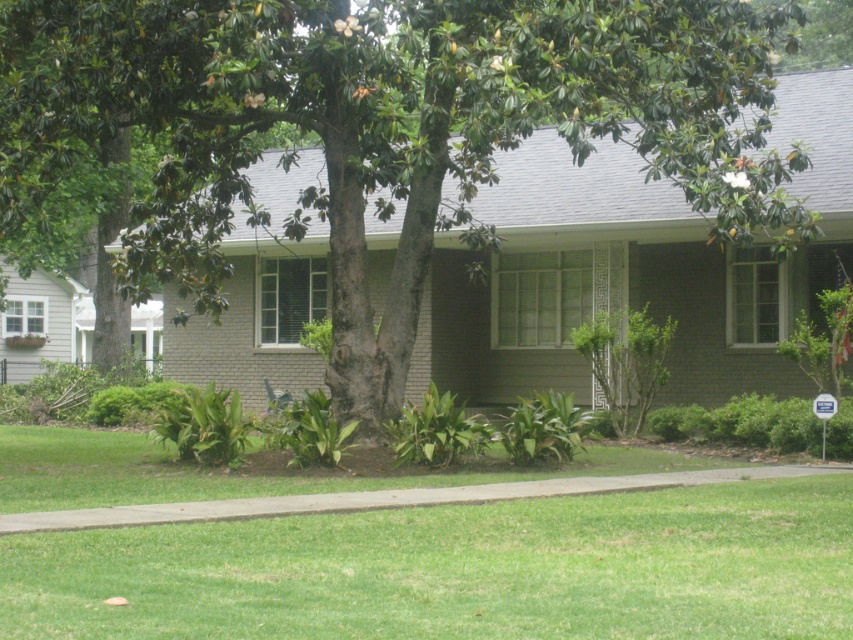
You are standing at the entrance of the suburban house and want to water the plant located at point [383,128]. Based on the given information, which plant should you water?

The point [383,128] is on the green leafy tree at center, so you should water the green leafy tree at center.

You are standing in front of the suburban house and want to determine the relative positions of two points marked on the house. Which point is closer to you, the point at coordinates point (x=405, y=268) or the point at coordinates point (x=669, y=532)?

Point (x=405, y=268) is closer to you than point (x=669, y=532) because it is further to the viewer, meaning it is nearer in the visual perspective.

In the scene shown: You are standing in front of the suburban house and want to water the green leafy tree at center. If your watering can has a range of 40 feet, will you need to move closer to reach it?

The green leafy tree at center is 42.51 feet away from viewer, so you will need to move closer to reach it as it is beyond the watering can range of 40 feet.